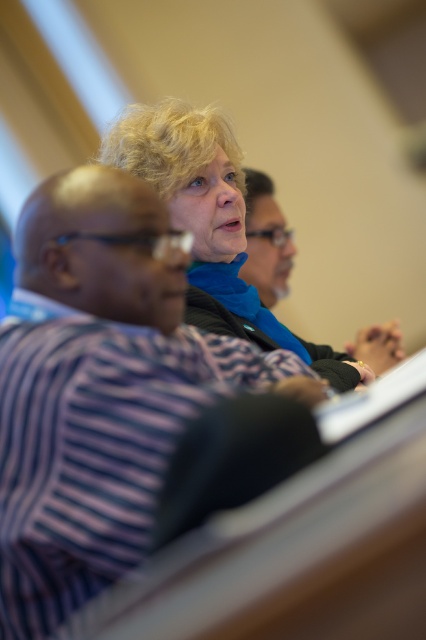
Question: Does purple striped shirt at upper center have a greater width compared to matte black shirt at center?

Choices:
 (A) no
 (B) yes

Answer: (B)

Question: Which of the following is the closest to the observer?

Choices:
 (A) purple striped shirt at upper center
 (B) matte black shirt at center

Answer: (A)

Question: Does purple striped shirt at upper center appear under matte black shirt at center?

Choices:
 (A) no
 (B) yes

Answer: (B)

Question: Among these objects, which one is farthest from the camera?

Choices:
 (A) purple striped shirt at upper center
 (B) matte black shirt at center

Answer: (B)

Question: Can you confirm if purple striped shirt at upper center is smaller than matte black shirt at center?

Choices:
 (A) yes
 (B) no

Answer: (B)